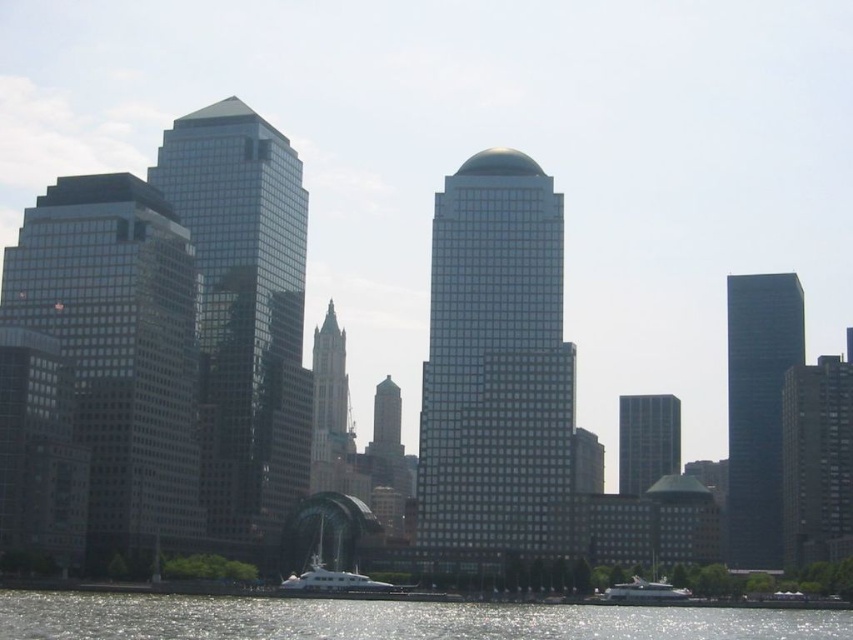
You are an architect analyzing the city skyline. You notice the shiny glass skyscraper at center and the smooth glass skyscraper at right. Which of these two buildings has a narrower width?

The shiny glass skyscraper at center has a narrower width than the smooth glass skyscraper at right.

You are standing on a boat docked at the waterfront and want to take a photo of the matte glass skyscraper at left. If your camera has a maximum zoom range of 100 meters, will you be able to capture the entire structure clearly?

The matte glass skyscraper at left is 129.87 meters away from the camera. Since the camera can only zoom up to 100 meters, you won stand too far away to capture the entire structure clearly.

You are standing on the dock and see the point marked at coordinates (119, 352). Which object in the scene does this point correspond to?

The point at (119, 352) corresponds to the matte glass skyscraper at left.